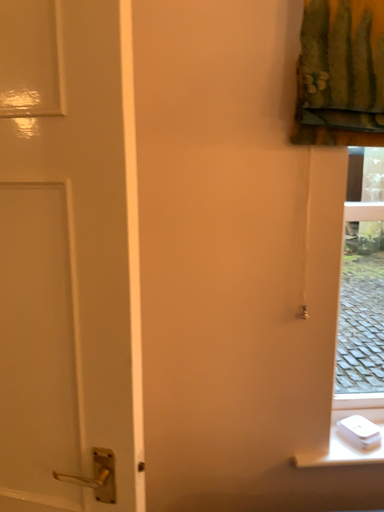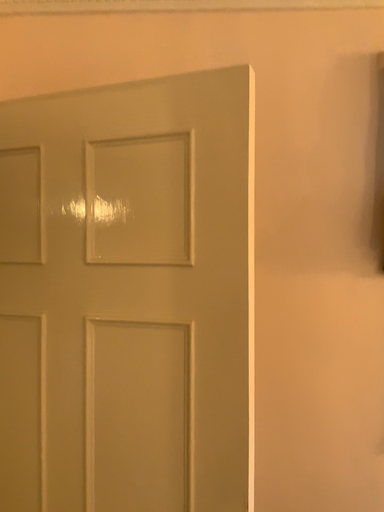
Question: Which way did the camera rotate in the video?

Choices:
 (A) rotated upward
 (B) rotated downward

Answer: (A)